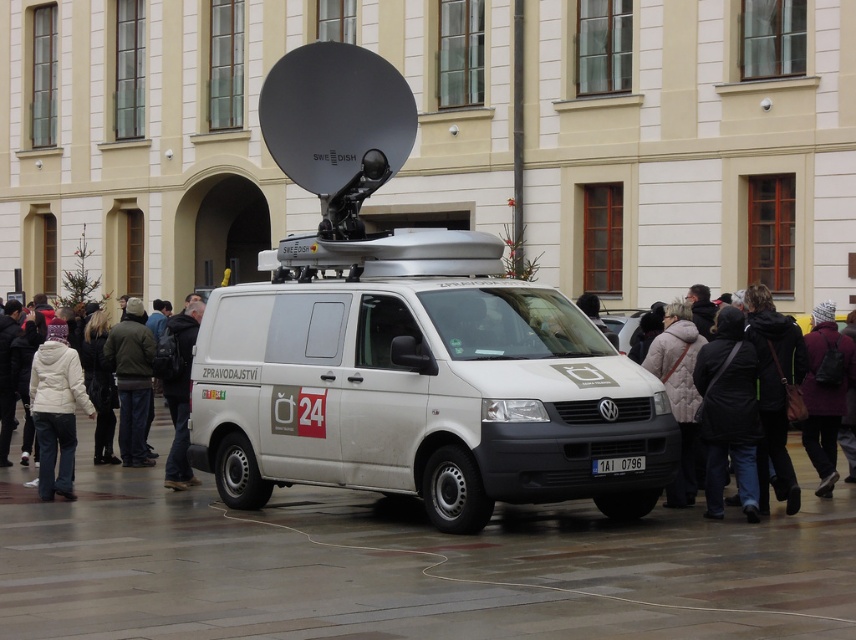
You are a delivery person who needs to park your vehicle in a spot that can only accommodate vehicles up to the size of the dark purple jacket at lower right. Based on the scene, can your white matte van at center fit into this parking spot?

The white matte van at center is larger in size than the dark purple jacket at lower right, so it cannot fit into the parking spot designated for vehicles up to the size of the dark purple jacket at lower right.

You are a photographer who needs to retrieve your camera and your white fleece jacket at left from the scene. The camera is located somewhere in the image. Given that the distance between them is 11.96 meters, can you estimate whether you can comfortably reach both items without moving more than 12 meters total? Please explain your reasoning.

The distance between the white fleece jacket at left and the camera is 11.96 meters. Since the total allowed distance is 12 meters, you can comfortably reach both items by moving a total of approximately 11.96 meters, which is within the 12 meters limit.

You are standing in front of the large building and want to take a photo of both the white matte van at center and the dark purple jacket at lower right. Which object should you focus on first to ensure both are in clear view?

You should focus on the white matte van at center first because it is closer to you than the dark purple jacket at lower right, so adjusting focus from near to far will help both be in clear view.